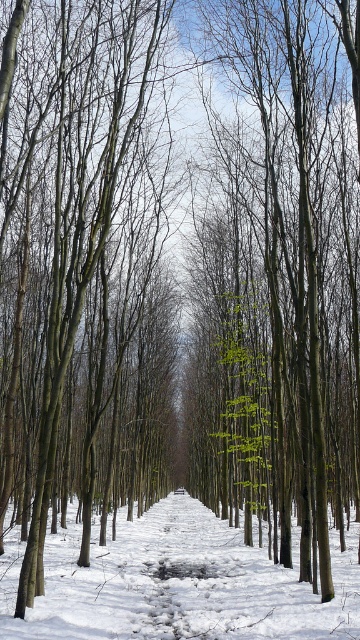
Is point (312, 19) behind point (18, 362)?

No, it is in front of (18, 362).

Does point (322, 593) come farther from viewer compared to point (84, 76)?

No.

You are a GUI agent. You are given a task and a screenshot of the screen. Output one action in this format:
    pyautogui.click(x=<x>, y=<y>)
    Task: Click on the green leafy tree at center
    
    Given the screenshot: What is the action you would take?
    pyautogui.click(x=277, y=285)

Is brown smooth tree at center below white powdery snow at center?

No.

What are the coordinates of `brown smooth tree at center` in the screenshot? It's located at (78, 230).

The image size is (360, 640). In order to click on brown smooth tree at center in this screenshot , I will do `click(78, 230)`.

Who is more distant from viewer, (250, 387) or (10, 564)?

Point (250, 387)

Does green leafy tree at center have a smaller size compared to white powdery snow at center?

No.

Between point (240, 33) and point (356, 604), which one is positioned behind?

The point (240, 33) is behind.

I want to click on green leafy tree at center, so click(x=277, y=285).